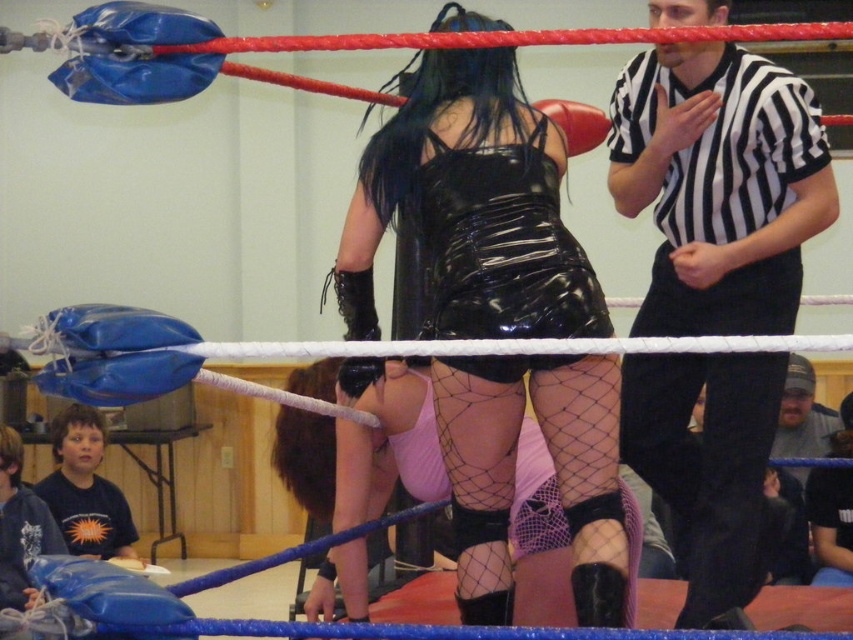
Based on the scene description, which wrestler is positioned higher in the ring, the one wearing the black shiny dress at center or the one in the black glossy dress at center?

The black shiny dress at center is much taller than the black glossy dress at center, so the wrestler in the black shiny dress at center is positioned higher in the ring.

Looking at this image, you are a photographer standing outside the wrestling ring. You want to take a closeup photo of the black shiny dress at center. The camera you have can focus on objects up to 8 feet away. Will you be able to take the photo without moving closer?

The black shiny dress at center and viewer are 7.50 feet apart from each other. Since the camera can focus up to 8 feet, the distance is within range. Yes, you can take the photo without moving closer.